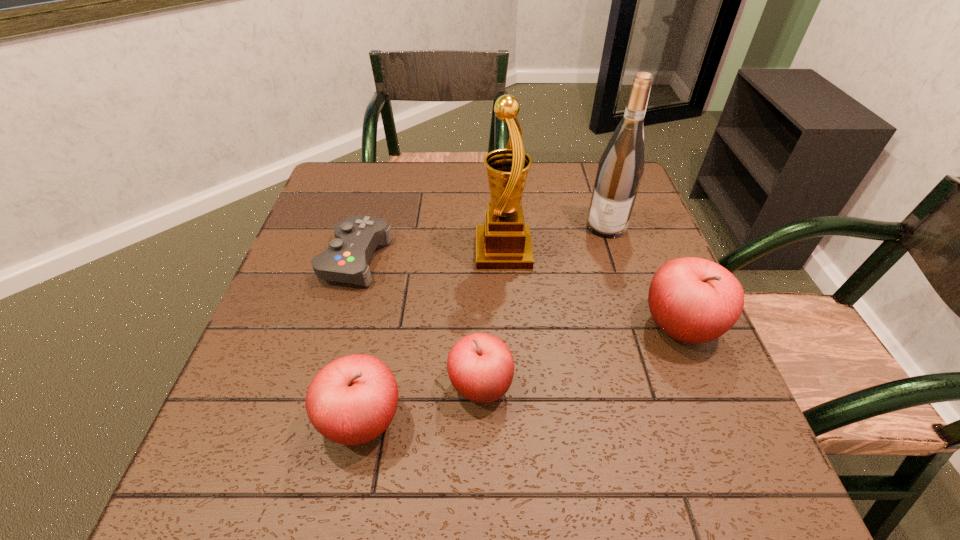
The width and height of the screenshot is (960, 540). What are the coordinates of `free space located 0.360m on the back of the rightmost apple` in the screenshot? It's located at (629, 203).

Locate an element on the screen. This screenshot has height=540, width=960. free space located on the back of the shortest object is located at coordinates (372, 200).

I want to click on free spot located 0.260m on the front-facing side of the award, so click(x=371, y=252).

Where is `vacant area situated 0.220m on the front-facing side of the award`? The width and height of the screenshot is (960, 540). vacant area situated 0.220m on the front-facing side of the award is located at coordinates (387, 252).

In order to click on free region located on the front-facing side of the award in this screenshot , I will do `click(371, 252)`.

Identify the location of vacant area situated 0.280m on the front of the wine bottle. (638, 325).

Where is `object at the left edge`? The image size is (960, 540). object at the left edge is located at coordinates click(346, 260).

Locate an element on the screen. apple that is at the right edge is located at coordinates (693, 300).

Locate an element on the screen. wine bottle that is at the right edge is located at coordinates (620, 169).

In order to click on vacant area at the far edge in this screenshot , I will do `click(397, 191)`.